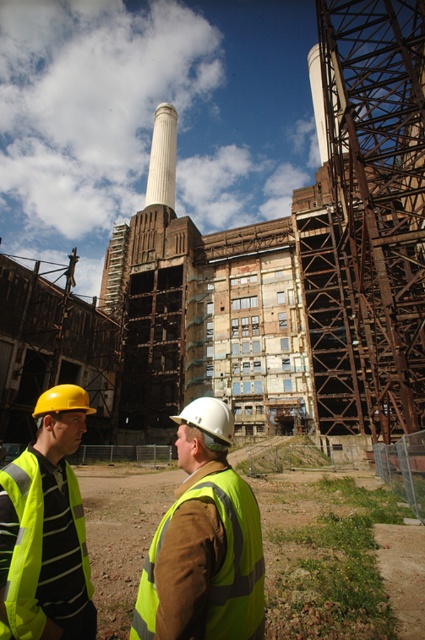
Question: Which point is farther from the camera taking this photo?

Choices:
 (A) (255, 596)
 (B) (51, 612)

Answer: (A)

Question: Does high-visibility fabric safety vest at center have a smaller size compared to yellow reflective safety vest at lower left?

Choices:
 (A) yes
 (B) no

Answer: (A)

Question: Which of the following is the closest to the observer?

Choices:
 (A) (33, 467)
 (B) (210, 637)

Answer: (B)

Question: Can you confirm if high-visibility fabric safety vest at center is positioned to the right of yellow reflective safety vest at lower left?

Choices:
 (A) yes
 (B) no

Answer: (A)

Question: Does high-visibility fabric safety vest at center appear on the left side of yellow reflective safety vest at lower left?

Choices:
 (A) no
 (B) yes

Answer: (A)